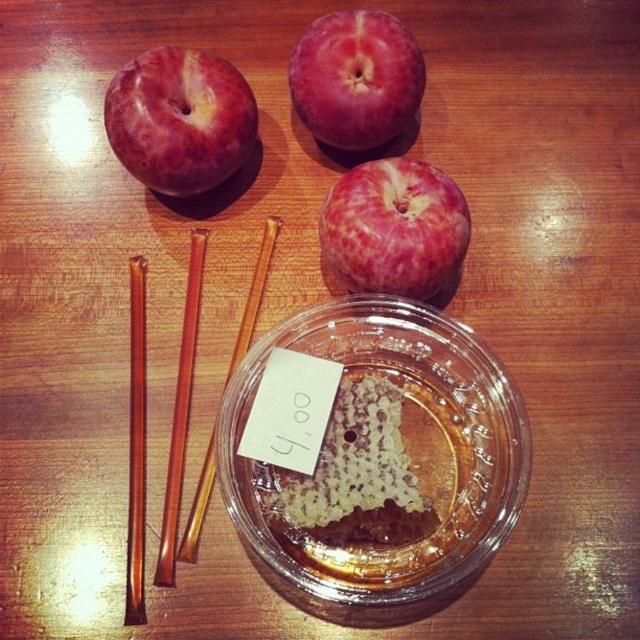
In the scene shown: You are looking at the wooden table with apples and chopsticks. There are two points marked on the table surface. Which point is closer to you, point (273, 486) or point (406, 284)?

Point (406, 284) is closer to you because the description states that point (273, 486) is behind point (406, 284), meaning the latter is in front and thus closer.

You are a chef preparing a dish and need to choose between the matte red apple at upper left and the translucent amber glass chopstick at upper center. Which object is wider?

The matte red apple at upper left is wider than the translucent amber glass chopstick at upper center.

You are a chef preparing a dessert and need to place both the translucent honeycomb at center and the pink matte apple at center on a plate. If the plate can only accommodate one of them, which one should you choose based on their sizes?

The translucent honeycomb at center is wider than the pink matte apple at center, so you should choose the translucent honeycomb at center to fit on the plate.